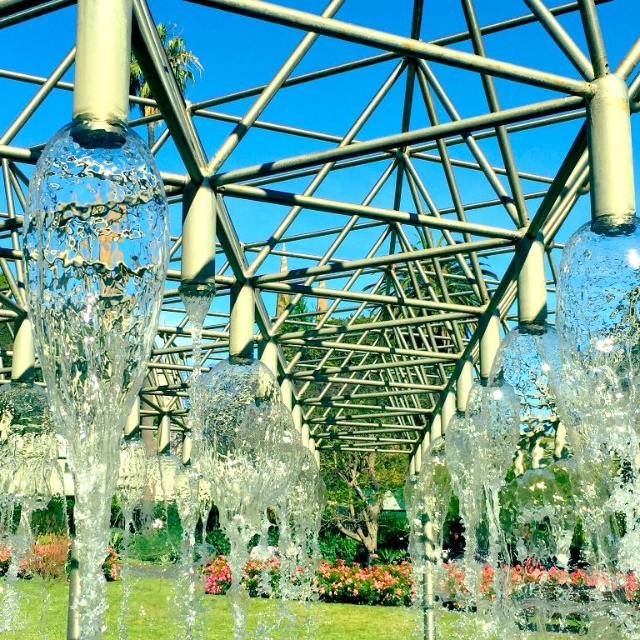
You are planning to take a photo of the transparent glass water at center left and the floral vibrant petals at center. Which object is shorter in height?

The transparent glass water at center left is shorter than the floral vibrant petals at center.

You are a maintenance worker needing to reach both the transparent glass water at center left and the floral vibrant petals at center with a 8 meter ladder. Can you safely reach both objects with this ladder?

The transparent glass water at center left is 7.91 meters from floral vibrant petals at center, so yes, the ladder can safely reach both objects since the distance between them is within the ladder length.

You are a gardener standing under the dome structure and want to water the floral vibrant petals at center without getting the flowers wet. Can you do so by using the transparent glass water at center left?

The transparent glass water at center left is located above the floral vibrant petals at center, so you can direct the water flow downward from the transparent glass water at center left to water the floral vibrant petals at center without getting the flowers wet.